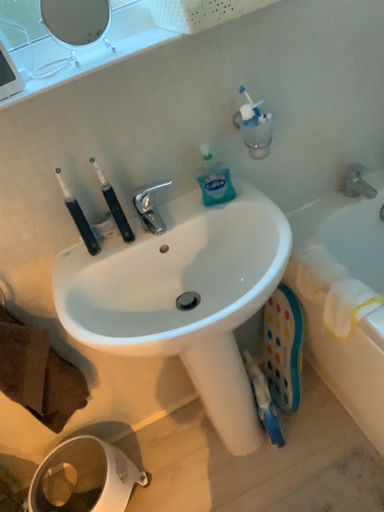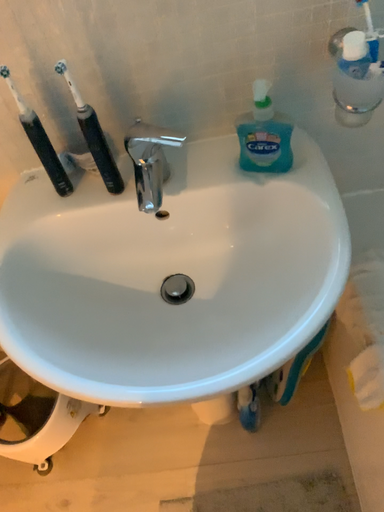
Question: How did the camera likely rotate when shooting the video?

Choices:
 (A) rotated right
 (B) rotated left

Answer: (B)